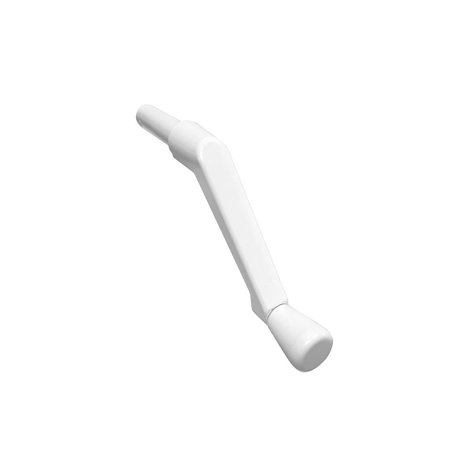
You are a GUI agent. You are given a task and a screenshot of the screen. Output one action in this format:
    pyautogui.click(x=<x>, y=<y>)
    Task: Click on the round edge of handle
    This screenshot has height=472, width=472.
    Given the screenshot: What is the action you would take?
    pyautogui.click(x=204, y=143)